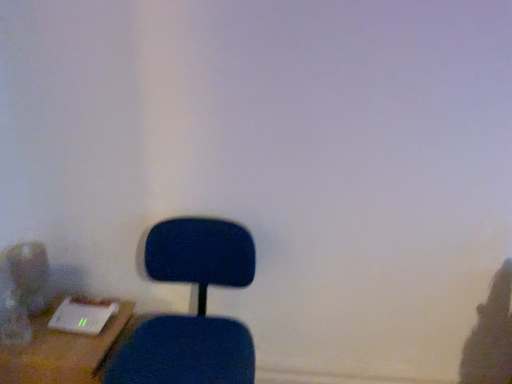
Question: Does wooden desk at lower left touch blue fabric chair at lower left?

Choices:
 (A) no
 (B) yes

Answer: (A)

Question: Is wooden desk at lower left to the right of blue fabric chair at lower left from the viewer's perspective?

Choices:
 (A) yes
 (B) no

Answer: (B)

Question: From a real-world perspective, is wooden desk at lower left over blue fabric chair at lower left?

Choices:
 (A) no
 (B) yes

Answer: (A)

Question: Is wooden desk at lower left facing towards blue fabric chair at lower left?

Choices:
 (A) yes
 (B) no

Answer: (A)

Question: Is wooden desk at lower left oriented away from blue fabric chair at lower left?

Choices:
 (A) no
 (B) yes

Answer: (A)

Question: Considering the relative sizes of wooden desk at lower left and blue fabric chair at lower left in the image provided, is wooden desk at lower left taller than blue fabric chair at lower left?

Choices:
 (A) yes
 (B) no

Answer: (B)

Question: Is blue fabric chair at lower left oriented towards wooden desk at lower left?

Choices:
 (A) no
 (B) yes

Answer: (A)

Question: From the image's perspective, would you say blue fabric chair at lower left is positioned over wooden desk at lower left?

Choices:
 (A) yes
 (B) no

Answer: (A)

Question: Is blue fabric chair at lower left shorter than wooden desk at lower left?

Choices:
 (A) yes
 (B) no

Answer: (B)

Question: Is blue fabric chair at lower left next to wooden desk at lower left and touching it?

Choices:
 (A) no
 (B) yes

Answer: (A)

Question: Does blue fabric chair at lower left lie in front of wooden desk at lower left?

Choices:
 (A) no
 (B) yes

Answer: (B)

Question: From a real-world perspective, does blue fabric chair at lower left stand above wooden desk at lower left?

Choices:
 (A) no
 (B) yes

Answer: (B)

Question: Considering the positions of point (156, 375) and point (42, 374), is point (156, 375) closer or farther from the camera than point (42, 374)?

Choices:
 (A) closer
 (B) farther

Answer: (A)